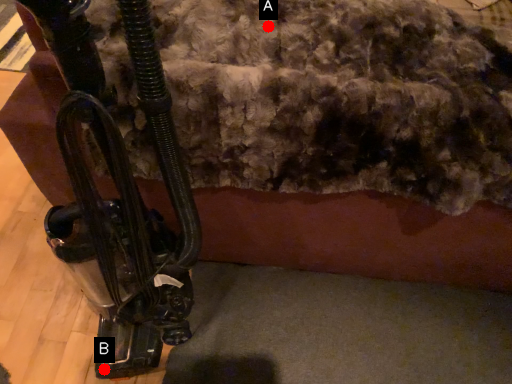
Question: Two points are circled on the image, labeled by A and B beside each circle. Which point is closer to the camera?

Choices:
 (A) A is closer
 (B) B is closer

Answer: (A)